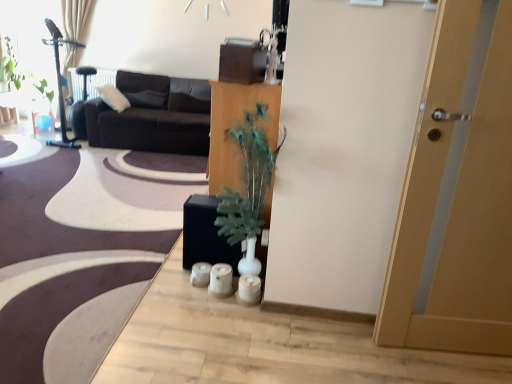
Question: Can you confirm if wooden cabinet at center is smaller than green leafy plant at upper left?

Choices:
 (A) no
 (B) yes

Answer: (A)

Question: Is the depth of wooden cabinet at center greater than that of green leafy plant at upper left?

Choices:
 (A) yes
 (B) no

Answer: (B)

Question: From the image's perspective, is wooden cabinet at center located above green leafy plant at upper left?

Choices:
 (A) yes
 (B) no

Answer: (B)

Question: From the image's perspective, is wooden cabinet at center located beneath green leafy plant at upper left?

Choices:
 (A) no
 (B) yes

Answer: (B)

Question: From a real-world perspective, is wooden cabinet at center positioned under green leafy plant at upper left based on gravity?

Choices:
 (A) yes
 (B) no

Answer: (A)

Question: Is wooden cabinet at center with green leafy plant at upper left?

Choices:
 (A) no
 (B) yes

Answer: (A)

Question: Is white soft pillow at upper left at the right side of transparent glass window screen at upper left?

Choices:
 (A) no
 (B) yes

Answer: (B)

Question: Is transparent glass window screen at upper left a part of white soft pillow at upper left?

Choices:
 (A) no
 (B) yes

Answer: (A)

Question: Can you confirm if white soft pillow at upper left is smaller than transparent glass window screen at upper left?

Choices:
 (A) yes
 (B) no

Answer: (B)

Question: Is white soft pillow at upper left directly adjacent to transparent glass window screen at upper left?

Choices:
 (A) no
 (B) yes

Answer: (A)

Question: Can you confirm if white soft pillow at upper left is thinner than transparent glass window screen at upper left?

Choices:
 (A) yes
 (B) no

Answer: (B)

Question: Is white soft pillow at upper left behind transparent glass window screen at upper left?

Choices:
 (A) yes
 (B) no

Answer: (B)

Question: Is dark brown fabric couch at upper left placed right next to green leafy plant at upper left?

Choices:
 (A) no
 (B) yes

Answer: (A)